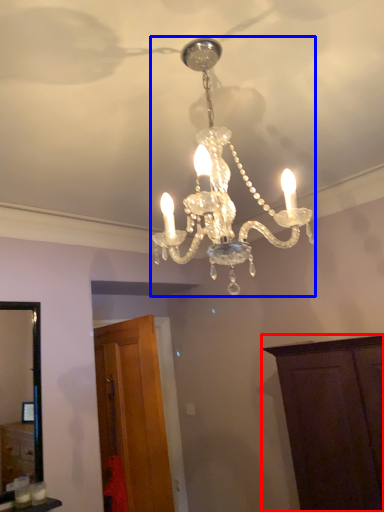
Question: Which of the following is the closest to the observer, cabinetry (highlighted by a red box) or lamp (highlighted by a blue box)?

Choices:
 (A) cabinetry
 (B) lamp

Answer: (B)